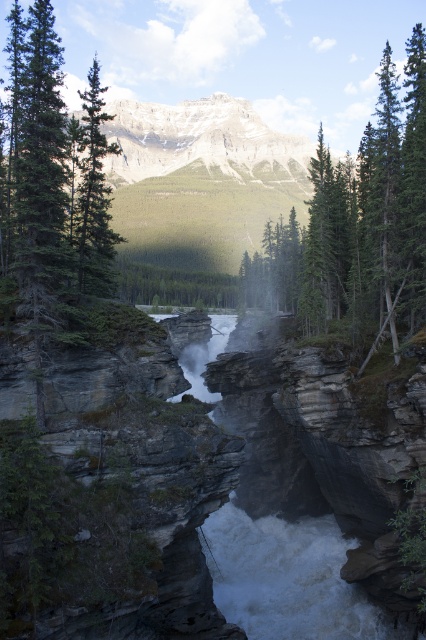
You are a hiker planning to take a photo of the canyon. You want to include both the green matte tree at center and the green matte tree at left in your shot. Which tree should you focus on to ensure both are in the frame?

You should focus on the green matte tree at center because it is larger and will be more visible, ensuring both trees are included in the frame.

You are standing at the edge of the canyon and want to determine the relative positions of two points marked in the scene. Which point is closer to you, point 1 at coordinates (x=368, y=252) or point 2 at coordinates (x=95, y=140)?

Point 2 at coordinates (x=95, y=140) is closer to you because it is less further to the viewer compared to point 1 at coordinates (x=368, y=252).